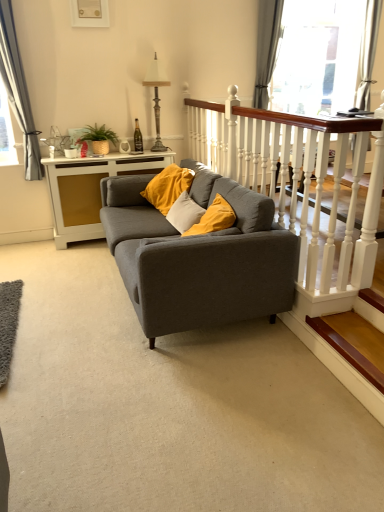
You are a GUI agent. You are given a task and a screenshot of the screen. Output one action in this format:
    pyautogui.click(x=<x>, y=<y>)
    Task: Click on the blank space above wooden at lower right (from a real-world perspective)
    This screenshot has height=512, width=384.
    Given the screenshot: What is the action you would take?
    click(364, 343)